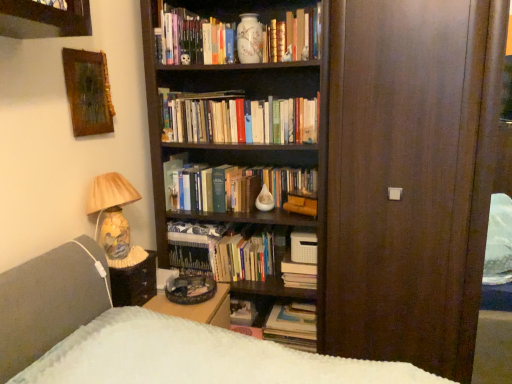
This screenshot has height=384, width=512. What do you see at coordinates (193, 38) in the screenshot?
I see `matte white vase at upper center, the 1th book from the top` at bounding box center [193, 38].

This screenshot has width=512, height=384. In order to click on hardcover book at lower center, the seventh book positioned from the top in this screenshot , I will do `click(292, 327)`.

The image size is (512, 384). What do you see at coordinates (193, 244) in the screenshot?
I see `hardcover book at center, which is counted as the 4th book, starting from the bottom` at bounding box center [193, 244].

Where is `brown wood door at center`? The image size is (512, 384). brown wood door at center is located at coordinates (406, 182).

The width and height of the screenshot is (512, 384). Identify the location of matte white vase at upper center, the 7th book from the bottom. (193, 38).

In the scene shown: Is wooden-framed painting at upper left placed right next to matte ceramic lamp at left?

No, wooden-framed painting at upper left is not next to matte ceramic lamp at left.

Is wooden-framed painting at upper left aimed at matte ceramic lamp at left?

No, wooden-framed painting at upper left is not oriented towards matte ceramic lamp at left.

Is matte ceramic lamp at left surrounded by wooden-framed painting at upper left?

No, wooden-framed painting at upper left does not contain matte ceramic lamp at left.

Can you confirm if wooden-framed painting at upper left is positioned to the right of matte ceramic lamp at left?

No.

Which is closer, (305, 118) or (275, 319)?

The point (305, 118) is closer.

Which is correct: hardcover books at center, which ranks as the 5th book in bottom-to-top order, is inside hardcover book at lower center, the seventh book positioned from the top, or outside of it?

The correct answer is: outside.

Is hardcover books at center, acting as the 3th book starting from the top, next to hardcover book at lower center, the seventh book positioned from the top?

No, hardcover books at center, acting as the 3th book starting from the top, is not touching hardcover book at lower center, the seventh book positioned from the top.

Between hardcover books at center, which ranks as the 5th book in bottom-to-top order, and hardcover book at lower center, which ranks as the 1th book in bottom-to-top order, which one is positioned behind?

hardcover book at lower center, which ranks as the 1th book in bottom-to-top order, is further from the camera.

How far apart are hardcover book at center, which is counted as the 4th book, starting from the bottom, and brown wood door at center?

The distance of hardcover book at center, which is counted as the 4th book, starting from the bottom, from brown wood door at center is 96.13 centimeters.

Which is in front, hardcover book at center, the 4th book when ordered from top to bottom, or brown wood door at center?

brown wood door at center is more forward.

Which is closer to the camera, (201,239) or (378,179)?

Point (201,239) is farther from the camera than point (378,179).

From the image's perspective, which is below, hardcover book at center, the 4th book when ordered from top to bottom, or brown wood door at center?

From the image's view, hardcover book at center, the 4th book when ordered from top to bottom, is below.

The image size is (512, 384). Find the location of `book that is the 4th one when counting downward from the hardcover books at center, acting as the 3th book starting from the top (from the image's perspective)`. book that is the 4th one when counting downward from the hardcover books at center, acting as the 3th book starting from the top (from the image's perspective) is located at coordinates (292, 327).

Is hardcover book at lower center, the seventh book positioned from the top, looking in the opposite direction of hardcover books at center, which ranks as the 5th book in bottom-to-top order?

No, hardcover book at lower center, the seventh book positioned from the top, is not facing away from hardcover books at center, which ranks as the 5th book in bottom-to-top order.

Between hardcover book at lower center, the seventh book positioned from the top, and hardcover books at center, acting as the 3th book starting from the top, which one appears on the left side from the viewer's perspective?

hardcover books at center, acting as the 3th book starting from the top, is more to the left.

How much distance is there between hardcover book at lower center, which ranks as the 1th book in bottom-to-top order, and hardcover books at center, acting as the 3th book starting from the top?

They are 1.01 meters apart.

Which object is thinner, matte ceramic vase at upper center, which is counted as the 2th book, starting from the top, or hardcover books at center, which is the second book from bottom to top?

matte ceramic vase at upper center, which is counted as the 2th book, starting from the top.

From a real-world perspective, which is physically above, matte ceramic vase at upper center, which is counted as the 2th book, starting from the top, or hardcover books at center, which is the second book from bottom to top?

matte ceramic vase at upper center, which is counted as the 2th book, starting from the top, from a real-world perspective.

Does point (280, 33) appear closer or farther from the camera than point (286, 255)?

Point (280, 33) is positioned closer to the camera compared to point (286, 255).

Considering the relative sizes of hardcover books at center, acting as the 3th book starting from the top, and wooden-framed painting at upper left in the image provided, is hardcover books at center, acting as the 3th book starting from the top, bigger than wooden-framed painting at upper left?

Correct, hardcover books at center, acting as the 3th book starting from the top, is larger in size than wooden-framed painting at upper left.

From a real-world perspective, is hardcover books at center, which ranks as the 5th book in bottom-to-top order, positioned over wooden-framed painting at upper left based on gravity?

No, from a real-world perspective, hardcover books at center, which ranks as the 5th book in bottom-to-top order, is not over wooden-framed painting at upper left

Based on the photo, which object is positioned more to the right, hardcover books at center, acting as the 3th book starting from the top, or wooden-framed painting at upper left?

From the viewer's perspective, hardcover books at center, acting as the 3th book starting from the top, appears more on the right side.

Locate an element on the screen. This screenshot has width=512, height=384. picture frame in front of the hardcover books at center, which ranks as the 5th book in bottom-to-top order is located at coordinates (88, 92).

Can you confirm if brown wood door at center is thinner than hardcover book at center, the 4th book when ordered from top to bottom?

Yes.

Is brown wood door at center spatially inside hardcover book at center, which is counted as the 4th book, starting from the bottom, or outside of it?

brown wood door at center cannot be found inside hardcover book at center, which is counted as the 4th book, starting from the bottom.

Is brown wood door at center further to camera compared to hardcover book at center, which is counted as the 4th book, starting from the bottom?

No.

Where is `picture frame behind the matte ceramic lamp at left`? picture frame behind the matte ceramic lamp at left is located at coordinates (88, 92).

Image resolution: width=512 pixels, height=384 pixels. Find the location of `book that is the 2nd object to the left of the hardcover book at lower center, the seventh book positioned from the top, starting at the anchor`. book that is the 2nd object to the left of the hardcover book at lower center, the seventh book positioned from the top, starting at the anchor is located at coordinates (240, 120).

Based on their spatial positions, is matte ceramic vase at upper center, which is counted as the 2th book, starting from the top, or hardcover books at center, acting as the 3th book starting from the top, closer to hardcover book at center, arranged as the fifth book when viewed from the top?

The object closer to hardcover book at center, arranged as the fifth book when viewed from the top, is hardcover books at center, acting as the 3th book starting from the top.

Which object lies further to the anchor point hardcover book at center, which is counted as the 4th book, starting from the bottom, matte ceramic lamp at left or wooden-framed painting at upper left?

wooden-framed painting at upper left is further to hardcover book at center, which is counted as the 4th book, starting from the bottom.

From the image, which object appears to be farther from matte ceramic lamp at left, hardcover book at center, the 4th book when ordered from top to bottom, or brown wood door at center?

brown wood door at center lies further to matte ceramic lamp at left than the other object.

When comparing their distances from wooden-framed painting at upper left, does matte ceramic vase at upper center, placed as the sixth book when sorted from bottom to top, or matte ceramic lamp at left seem closer?

matte ceramic lamp at left is closer to wooden-framed painting at upper left.

Which object lies nearer to the anchor point brown wood door at center, matte white vase at upper center, the 1th book from the top, or hardcover books at center, acting as the 3th book starting from the top?

The object closer to brown wood door at center is hardcover books at center, acting as the 3th book starting from the top.

Based on the photo, considering their positions, is hardcover book at center, acting as the third book starting from the bottom, positioned further to hardcover books at center, which is the second book from bottom to top, than hardcover books at center, which ranks as the 5th book in bottom-to-top order?

Among the two, hardcover books at center, which ranks as the 5th book in bottom-to-top order, is located further to hardcover books at center, which is the second book from bottom to top.

Considering their positions, is hardcover book at center, which is counted as the 4th book, starting from the bottom, positioned closer to matte white vase at upper center, the 1th book from the top, than matte ceramic lamp at left?

matte ceramic lamp at left is positioned closer to the anchor matte white vase at upper center, the 1th book from the top.

In the scene shown: When comparing their distances from hardcover book at center, the 4th book when ordered from top to bottom, does wooden-framed painting at upper left or matte ceramic lamp at left seem closer?

Based on the image, matte ceramic lamp at left appears to be nearer to hardcover book at center, the 4th book when ordered from top to bottom.

Find the location of a particular element. table that lies between matte white vase at upper center, the 1th book from the top, and hardcover books at center, which is the second book from bottom to top, from top to bottom is located at coordinates (134, 282).

I want to click on table between hardcover books at center, which ranks as the 5th book in bottom-to-top order, and hardcover books at center, which is the second book from bottom to top, in the up-down direction, so click(x=134, y=282).

Identify the location of glass door between matte ceramic vase at upper center, which is counted as the 2th book, starting from the top, and hardcover book at center, the 4th book when ordered from top to bottom, in the vertical direction. The width and height of the screenshot is (512, 384). (406, 182).

Locate an element on the screen. table positioned between matte ceramic lamp at left and hardcover book at center, arranged as the fifth book when viewed from the top, from near to far is located at coordinates (134, 282).